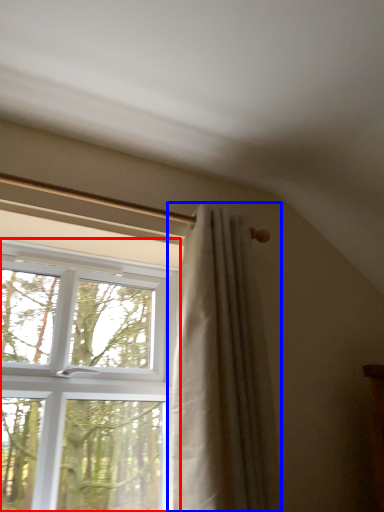
Question: Which object is further to the camera taking this photo, window (highlighted by a red box) or curtain (highlighted by a blue box)?

Choices:
 (A) window
 (B) curtain

Answer: (B)